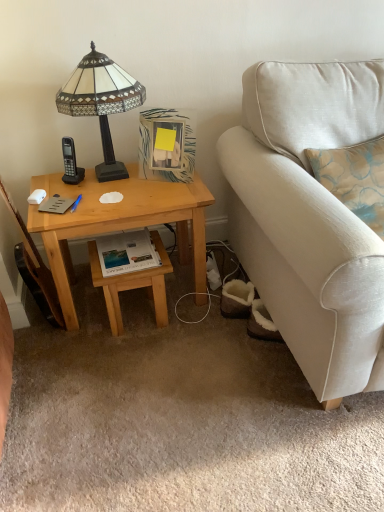
This screenshot has height=512, width=384. What are the coordinates of `vacant space that's between light wood stool at lower center and light wood desk at left` in the screenshot? It's located at (147, 324).